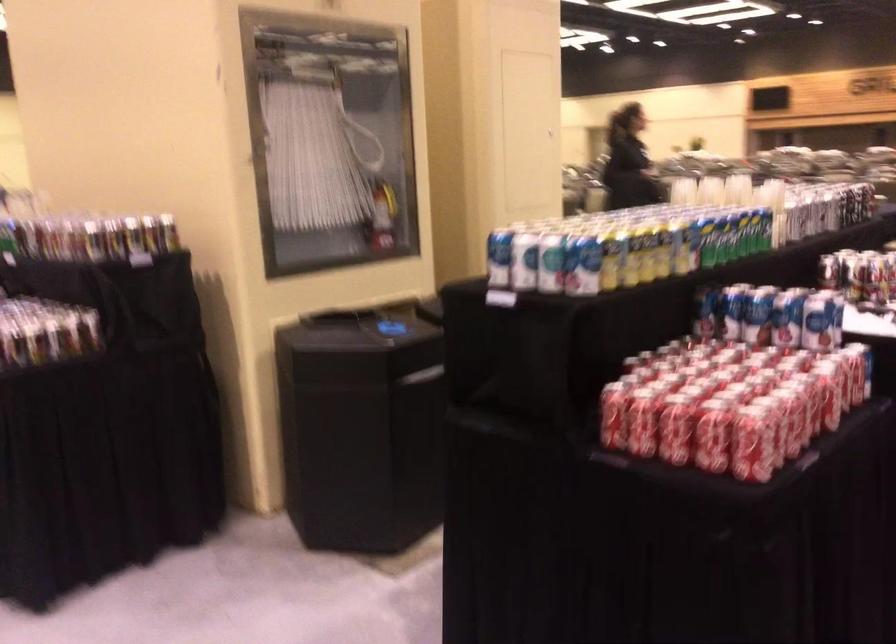
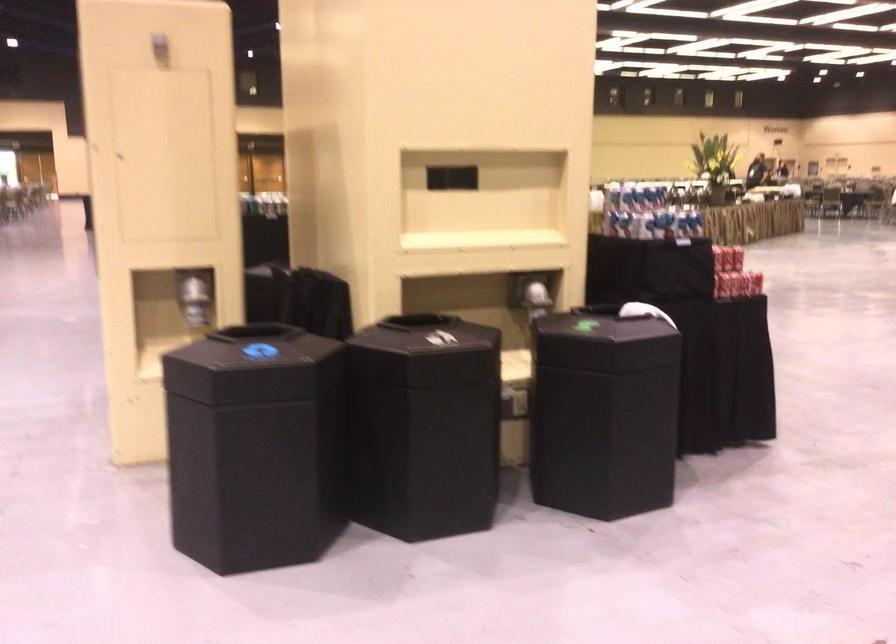
Question: I am providing you with two images of the same scene from different viewpoints. Which of the following objects are not visible in image2?

Choices:
 (A) shiny dispenser lever
 (B) black box strap
 (C) red soda can
 (D) black bin lid

Answer: (C)